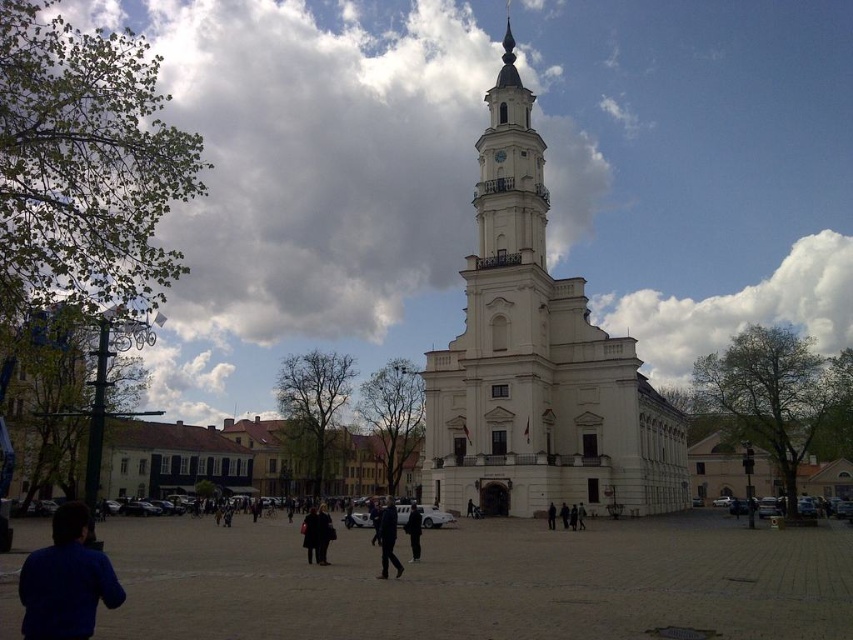
This screenshot has width=853, height=640. Describe the element at coordinates (387, 538) in the screenshot. I see `dark blue jeans at center` at that location.

Is dark blue jeans at center shorter than dark brown leather jacket at center?

Yes.

This screenshot has height=640, width=853. Describe the element at coordinates (387, 538) in the screenshot. I see `dark blue jeans at center` at that location.

You are a GUI agent. You are given a task and a screenshot of the screen. Output one action in this format:
    pyautogui.click(x=<x>, y=<y>)
    Task: Click on the dark blue jeans at center
    The image size is (853, 640).
    Given the screenshot: What is the action you would take?
    pyautogui.click(x=387, y=538)

Is dark blue jeans at center in front of dark gray fabric jacket at center?

Yes, it is in front of dark gray fabric jacket at center.

You are a GUI agent. You are given a task and a screenshot of the screen. Output one action in this format:
    pyautogui.click(x=<x>, y=<y>)
    Task: Click on the dark blue jeans at center
    The width and height of the screenshot is (853, 640).
    Given the screenshot: What is the action you would take?
    click(387, 538)

Locate an element on the screen. dark blue jeans at center is located at coordinates (387, 538).

Where is `dark blue jeans at center`? The image size is (853, 640). dark blue jeans at center is located at coordinates (387, 538).

Is point (44, 580) farther from viewer compared to point (392, 525)?

That is False.

The width and height of the screenshot is (853, 640). What do you see at coordinates (67, 580) in the screenshot?
I see `blue fabric jacket at lower left` at bounding box center [67, 580].

Does point (18, 596) lie in front of point (380, 509)?

Yes, point (18, 596) is in front of point (380, 509).

Find the location of a particular element. The image size is (853, 640). blue fabric jacket at lower left is located at coordinates (67, 580).